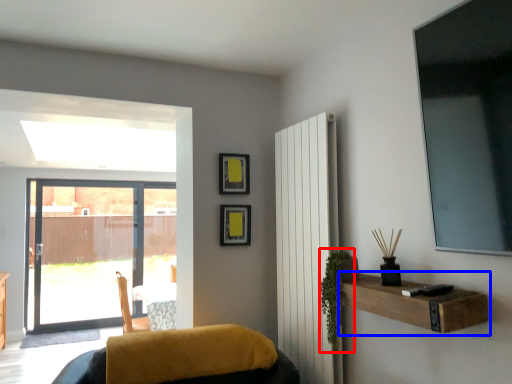
Question: Which of the following is the closest to the observer, plant (highlighted by a red box) or shelf (highlighted by a blue box)?

Choices:
 (A) plant
 (B) shelf

Answer: (B)